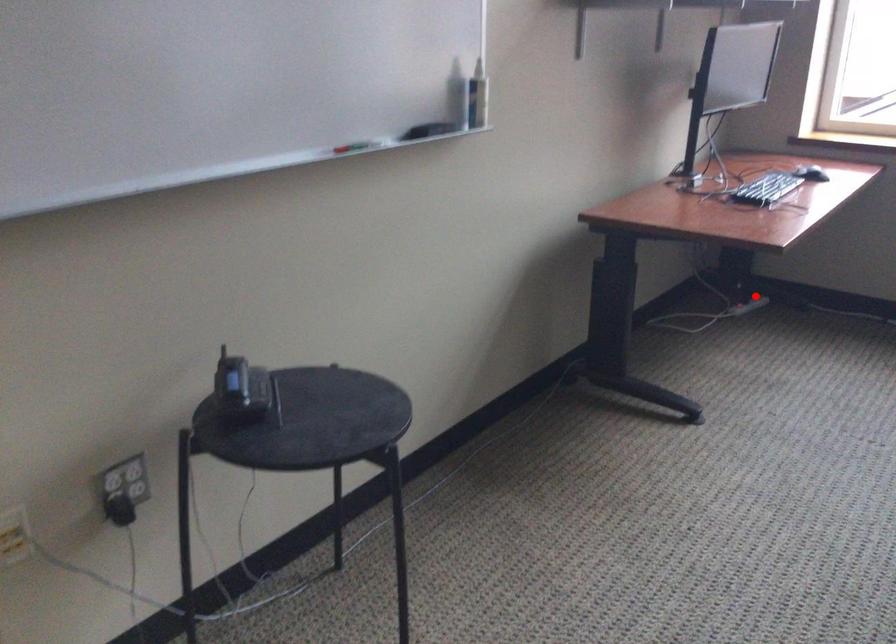
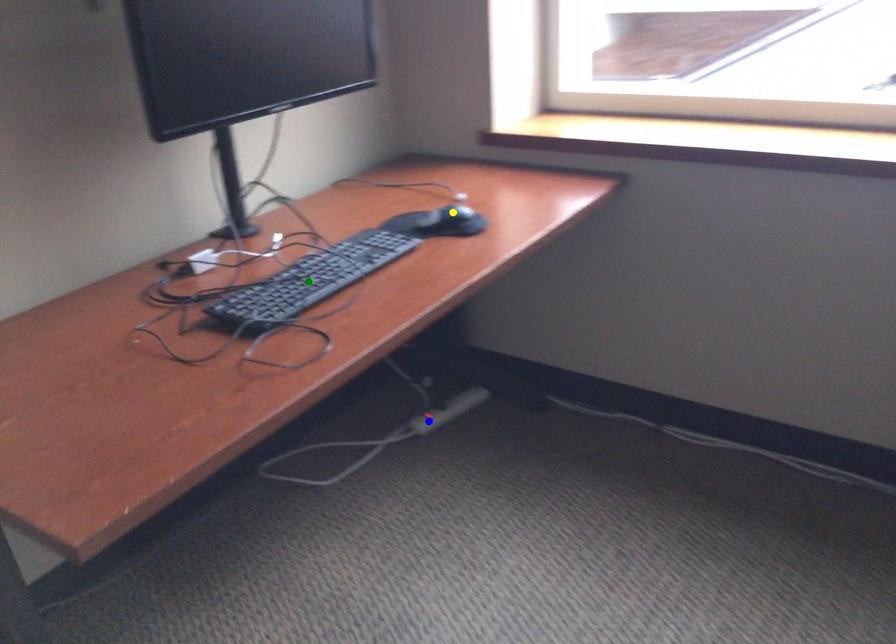
Question: I am providing you with two images of the same scene from different viewpoints. A red point is marked on the first image. You are given multiple points on the second image. In image 2, which mark is for the same physical point as the one in image 1?

Choices:
 (A) blue point
 (B) green point
 (C) yellow point

Answer: (A)